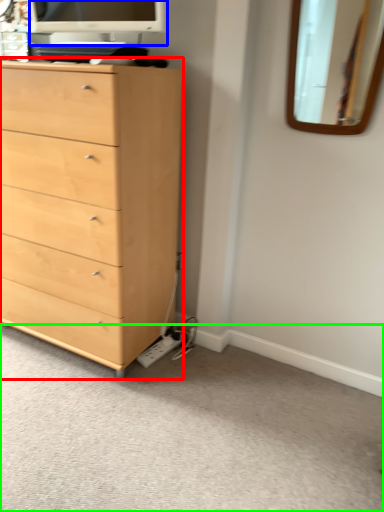
Question: Based on their relative distances, which object is farther from chest of drawers (highlighted by a red box)? Choose from computer monitor (highlighted by a blue box) and plain (highlighted by a green box).

Choices:
 (A) computer monitor
 (B) plain

Answer: (A)